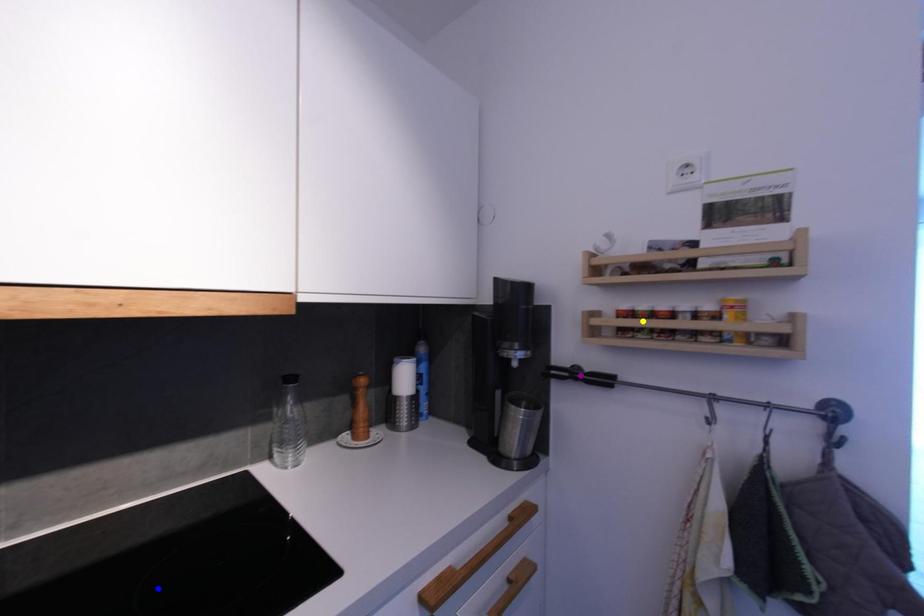
Order these from farthest to nearest:
- yellow point
- purple point
- blue point

purple point
yellow point
blue point